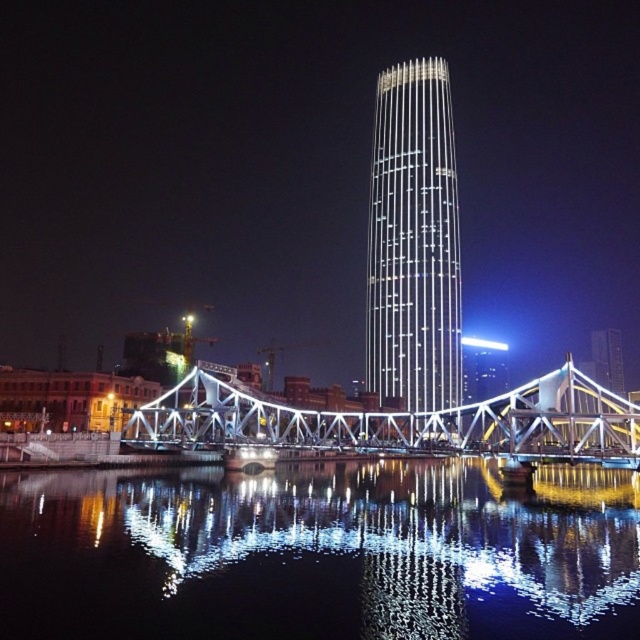
Which is below, black reflective water at center or metallic bridge at center?

black reflective water at center

Does black reflective water at center come in front of metallic bridge at center?

That is True.

The image size is (640, 640). In order to click on black reflective water at center in this screenshot , I will do `click(321, 554)`.

You are a GUI agent. You are given a task and a screenshot of the screen. Output one action in this format:
    pyautogui.click(x=<x>, y=<y>)
    Task: Click on the black reflective water at center
    This screenshot has width=640, height=640.
    Given the screenshot: What is the action you would take?
    pyautogui.click(x=321, y=554)

Which is more to the left, shiny glass tower at center or metallic bridge at center?

metallic bridge at center

Does shiny glass tower at center have a lesser width compared to metallic bridge at center?

Yes.

Does point (396, 74) come in front of point (595, 429)?

No.

The height and width of the screenshot is (640, 640). I want to click on shiny glass tower at center, so click(413, 241).

Between point (490, 486) and point (448, 225), which one is positioned behind?

Point (448, 225)

Between point (563, 609) and point (380, 104), which one is positioned behind?

The point (380, 104) is more distant.

The height and width of the screenshot is (640, 640). I want to click on black reflective water at center, so click(321, 554).